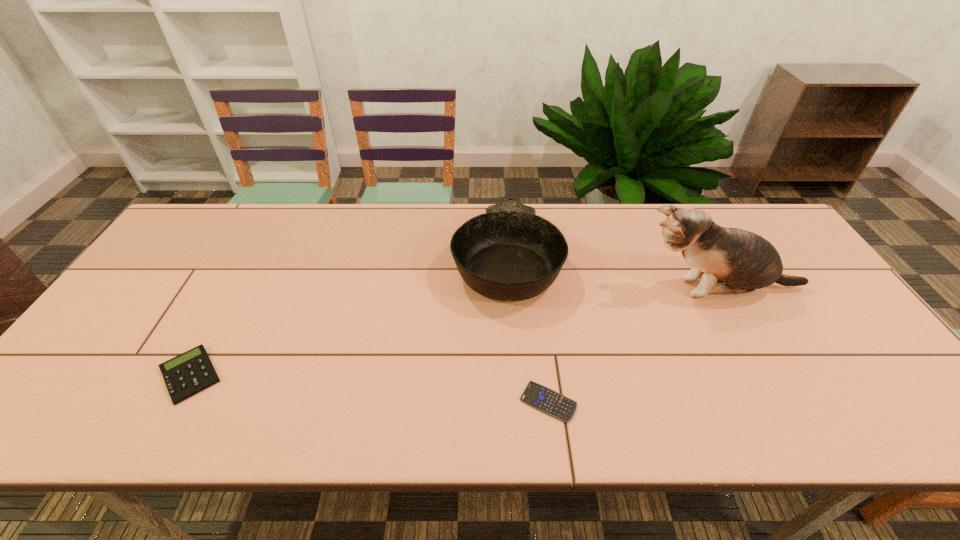
Where is `free space that is in between the frying pan and the left calculator`? The height and width of the screenshot is (540, 960). free space that is in between the frying pan and the left calculator is located at coordinates (348, 317).

Image resolution: width=960 pixels, height=540 pixels. Identify the location of free space between the shortest object and the cat. (634, 345).

Where is `vacant space that's between the third tallest object and the shorter calculator`? The width and height of the screenshot is (960, 540). vacant space that's between the third tallest object and the shorter calculator is located at coordinates (370, 389).

Find the location of a particular element. free space between the frying pan and the shortest object is located at coordinates (527, 330).

Where is `vacant point located between the leftmost object and the rightmost object`? vacant point located between the leftmost object and the rightmost object is located at coordinates (454, 332).

Find the location of a particular element. free point between the shorter calculator and the third shortest object is located at coordinates (527, 330).

Locate an element on the screen. vacant point located between the third tallest object and the shortest object is located at coordinates (370, 389).

Find the location of a particular element. This screenshot has width=960, height=540. unoccupied area between the rightmost object and the third shortest object is located at coordinates (x=612, y=273).

Where is `object that is the closest to the shorter calculator`? The image size is (960, 540). object that is the closest to the shorter calculator is located at coordinates (508, 253).

Identify which object is the closest to the shorter calculator. Please provide its 2D coordinates. Your answer should be formatted as a tuple, i.e. [(x, y)], where the tuple contains the x and y coordinates of a point satisfying the conditions above.

[(508, 253)]